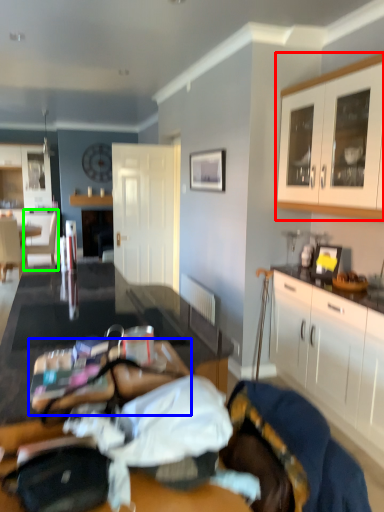
Question: Estimate the real-world distances between objects in this image. Which object is farther from cabinetry (highlighted by a red box), table (highlighted by a blue box) or armchair (highlighted by a green box)?

Choices:
 (A) table
 (B) armchair

Answer: (B)